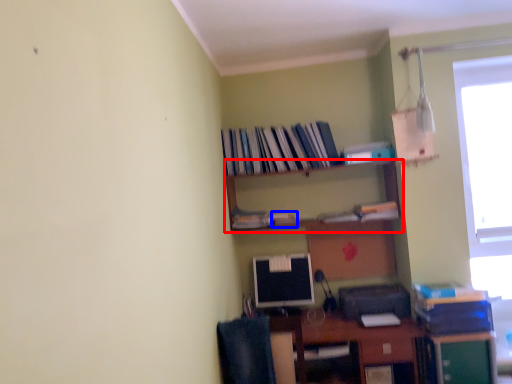
Question: Among these objects, which one is nearest to the camera, shelf (highlighted by a red box) or book (highlighted by a blue box)?

Choices:
 (A) shelf
 (B) book

Answer: (A)